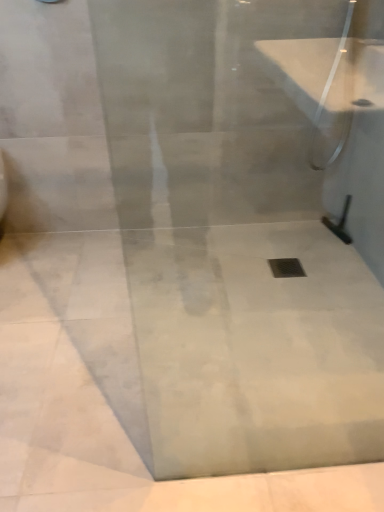
From the picture: What is the approximate height of white marble concrete at center?

It is 1.63 inches.

Where is `white marble concrete at center`? white marble concrete at center is located at coordinates (281, 357).

What do you see at coordinates (327, 95) in the screenshot?
I see `clear glass shower door at upper right, which ranks as the first shower in top-to-bottom order` at bounding box center [327, 95].

In order to face clear glass shower door at upper right, the 2th shower when ordered from bottom to top, should I rotate leftwards or rightwards?

Turn right approximately 19.173 degrees to face it.

I want to click on white marble concrete at center, so click(281, 357).

How far apart are black rubber squeegee at right, which is the first shower in bottom-to-top order, and clear glass shower door at upper right, the 2th shower when ordered from bottom to top?

A distance of 35.40 centimeters exists between black rubber squeegee at right, which is the first shower in bottom-to-top order, and clear glass shower door at upper right, the 2th shower when ordered from bottom to top.

Looking at the image, does black rubber squeegee at right, which is the first shower in bottom-to-top order, seem bigger or smaller compared to clear glass shower door at upper right, which ranks as the first shower in top-to-bottom order?

Considering their sizes, black rubber squeegee at right, which is the first shower in bottom-to-top order, takes up less space than clear glass shower door at upper right, which ranks as the first shower in top-to-bottom order.

From a real-world perspective, is black rubber squeegee at right, marked as the 2th shower in a top-to-bottom arrangement, located beneath clear glass shower door at upper right, which ranks as the first shower in top-to-bottom order?

Indeed, from a real-world perspective, black rubber squeegee at right, marked as the 2th shower in a top-to-bottom arrangement, is positioned beneath clear glass shower door at upper right, which ranks as the first shower in top-to-bottom order.

Can you confirm if black rubber squeegee at right, marked as the 2th shower in a top-to-bottom arrangement, is taller than clear glass shower door at upper right, the 2th shower when ordered from bottom to top?

No.

Which is closer, (333, 157) or (345, 211)?

Point (333, 157) appears to be closer to the viewer than point (345, 211).

Is clear glass shower door at upper right, which ranks as the first shower in top-to-bottom order, not near black rubber squeegee at right, marked as the 2th shower in a top-to-bottom arrangement?

No.

Looking at the image, does clear glass shower door at upper right, the 2th shower when ordered from bottom to top, seem bigger or smaller compared to black rubber squeegee at right, marked as the 2th shower in a top-to-bottom arrangement?

Clearly, clear glass shower door at upper right, the 2th shower when ordered from bottom to top, is larger in size than black rubber squeegee at right, marked as the 2th shower in a top-to-bottom arrangement.

Is clear glass shower door at upper right, the 2th shower when ordered from bottom to top, oriented away from black rubber squeegee at right, marked as the 2th shower in a top-to-bottom arrangement?

No, black rubber squeegee at right, marked as the 2th shower in a top-to-bottom arrangement, is not at the back of clear glass shower door at upper right, the 2th shower when ordered from bottom to top.

From the picture: Between metallic silver drain at center and white marble concrete at center, which one appears on the left side from the viewer's perspective?

white marble concrete at center is more to the left.

Who is more distant, metallic silver drain at center or white marble concrete at center?

Positioned behind is metallic silver drain at center.

Is metallic silver drain at center next to white marble concrete at center and touching it?

metallic silver drain at center is not next to white marble concrete at center, and they're not touching.

Is point (281, 265) positioned before point (118, 323)?

No, it is behind (118, 323).

Can you confirm if white marble concrete at center is smaller than clear glass shower door at upper right, the 2th shower when ordered from bottom to top?

No, white marble concrete at center is not smaller than clear glass shower door at upper right, the 2th shower when ordered from bottom to top.

Which object is positioned more to the left, white marble concrete at center or clear glass shower door at upper right, the 2th shower when ordered from bottom to top?

white marble concrete at center.

Is the surface of white marble concrete at center in direct contact with clear glass shower door at upper right, which ranks as the first shower in top-to-bottom order?

No, white marble concrete at center is not next to clear glass shower door at upper right, which ranks as the first shower in top-to-bottom order.

Is white marble concrete at center looking in the opposite direction of clear glass shower door at upper right, the 2th shower when ordered from bottom to top?

No, clear glass shower door at upper right, the 2th shower when ordered from bottom to top, is not at the back of white marble concrete at center.

From the image's perspective, is metallic silver drain at center above black rubber squeegee at right, which is the first shower in bottom-to-top order?

No, from the image's perspective, metallic silver drain at center is not above black rubber squeegee at right, which is the first shower in bottom-to-top order.

Which of these two, metallic silver drain at center or black rubber squeegee at right, which is the first shower in bottom-to-top order, is thinner?

Thinner between the two is black rubber squeegee at right, which is the first shower in bottom-to-top order.

Considering the sizes of objects metallic silver drain at center and black rubber squeegee at right, which is the first shower in bottom-to-top order, in the image provided, who is bigger, metallic silver drain at center or black rubber squeegee at right, which is the first shower in bottom-to-top order,?

black rubber squeegee at right, which is the first shower in bottom-to-top order.

How different are the orientations of metallic silver drain at center and black rubber squeegee at right, which is the first shower in bottom-to-top order, in degrees?

There is a 1.59-degree angle between the facing directions of metallic silver drain at center and black rubber squeegee at right, which is the first shower in bottom-to-top order.

Is point (343, 141) closer to viewer compared to point (271, 271)?

No, (343, 141) is further to viewer.

Does clear glass shower door at upper right, which ranks as the first shower in top-to-bottom order, come in front of metallic silver drain at center?

Yes, clear glass shower door at upper right, which ranks as the first shower in top-to-bottom order, is in front of metallic silver drain at center.

Between clear glass shower door at upper right, the 2th shower when ordered from bottom to top, and metallic silver drain at center, which one has larger width?

Wider between the two is metallic silver drain at center.

Can you see clear glass shower door at upper right, which ranks as the first shower in top-to-bottom order, touching metallic silver drain at center?

No, clear glass shower door at upper right, which ranks as the first shower in top-to-bottom order, is not making contact with metallic silver drain at center.

Find the location of `drain located below the black rubber squeegee at right, which is the first shower in bottom-to-top order (from the image's perspective)`. drain located below the black rubber squeegee at right, which is the first shower in bottom-to-top order (from the image's perspective) is located at coordinates (286, 268).

Can you confirm if black rubber squeegee at right, which is the first shower in bottom-to-top order, is bigger than metallic silver drain at center?

Indeed, black rubber squeegee at right, which is the first shower in bottom-to-top order, has a larger size compared to metallic silver drain at center.

From the image's perspective, is black rubber squeegee at right, which is the first shower in bottom-to-top order, above or below metallic silver drain at center?

Clearly, from the image's perspective, black rubber squeegee at right, which is the first shower in bottom-to-top order, is above metallic silver drain at center.

Is point (350, 199) farther from viewer compared to point (277, 262)?

Yes, it is.

The width and height of the screenshot is (384, 512). I want to click on shower lying above the black rubber squeegee at right, which is the first shower in bottom-to-top order (from the image's perspective), so click(327, 95).

Locate an element on the screen. Image resolution: width=384 pixels, height=512 pixels. shower in front of the black rubber squeegee at right, which is the first shower in bottom-to-top order is located at coordinates (327, 95).

Estimate the real-world distances between objects in this image. Which object is closer to black rubber squeegee at right, marked as the 2th shower in a top-to-bottom arrangement, metallic silver drain at center or white marble concrete at center?

metallic silver drain at center lies closer to black rubber squeegee at right, marked as the 2th shower in a top-to-bottom arrangement, than the other object.

Looking at the image, which one is located closer to clear glass shower door at upper right, the 2th shower when ordered from bottom to top, white marble concrete at center or black rubber squeegee at right, marked as the 2th shower in a top-to-bottom arrangement?

Among the two, black rubber squeegee at right, marked as the 2th shower in a top-to-bottom arrangement, is located nearer to clear glass shower door at upper right, the 2th shower when ordered from bottom to top.

Estimate the real-world distances between objects in this image. Which object is further from clear glass shower door at upper right, which ranks as the first shower in top-to-bottom order, white marble concrete at center or metallic silver drain at center?

Among the two, white marble concrete at center is located further to clear glass shower door at upper right, which ranks as the first shower in top-to-bottom order.

In the scene shown: Estimate the real-world distances between objects in this image. Which object is further from white marble concrete at center, metallic silver drain at center or clear glass shower door at upper right, the 2th shower when ordered from bottom to top?

The object further to white marble concrete at center is clear glass shower door at upper right, the 2th shower when ordered from bottom to top.

Which object lies further to the anchor point black rubber squeegee at right, which is the first shower in bottom-to-top order, white marble concrete at center or clear glass shower door at upper right, which ranks as the first shower in top-to-bottom order?

white marble concrete at center is positioned further to the anchor black rubber squeegee at right, which is the first shower in bottom-to-top order.

When comparing their distances from clear glass shower door at upper right, the 2th shower when ordered from bottom to top, does black rubber squeegee at right, which is the first shower in bottom-to-top order, or white marble concrete at center seem further?

white marble concrete at center is further to clear glass shower door at upper right, the 2th shower when ordered from bottom to top.

From the image, which object appears to be nearer to clear glass shower door at upper right, the 2th shower when ordered from bottom to top, metallic silver drain at center or black rubber squeegee at right, which is the first shower in bottom-to-top order?

Among the two, black rubber squeegee at right, which is the first shower in bottom-to-top order, is located nearer to clear glass shower door at upper right, the 2th shower when ordered from bottom to top.

Based on their spatial positions, is black rubber squeegee at right, which is the first shower in bottom-to-top order, or metallic silver drain at center closer to white marble concrete at center?

metallic silver drain at center is positioned closer to the anchor white marble concrete at center.

Locate an element on the screen. shower between clear glass shower door at upper right, which ranks as the first shower in top-to-bottom order, and metallic silver drain at center vertically is located at coordinates (340, 223).

This screenshot has height=512, width=384. What are the coordinates of `drain between clear glass shower door at upper right, the 2th shower when ordered from bottom to top, and white marble concrete at center, in the vertical direction` in the screenshot? It's located at (286, 268).

I want to click on drain positioned between white marble concrete at center and black rubber squeegee at right, which is the first shower in bottom-to-top order, from near to far, so click(x=286, y=268).

You are a GUI agent. You are given a task and a screenshot of the screen. Output one action in this format:
    pyautogui.click(x=<x>, y=<y>)
    Task: Click on the shower between clear glass shower door at upper right, which ranks as the first shower in top-to-bottom order, and white marble concrete at center vertically
    
    Given the screenshot: What is the action you would take?
    tap(340, 223)